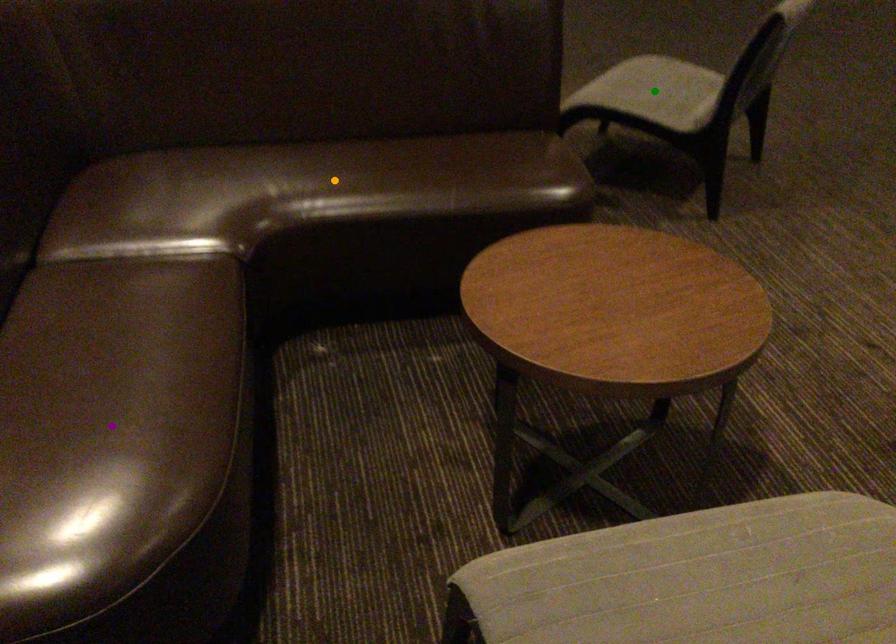
Looking at this image, order these from nearest to farthest:
A) orange point
B) green point
C) purple point

purple point, orange point, green point